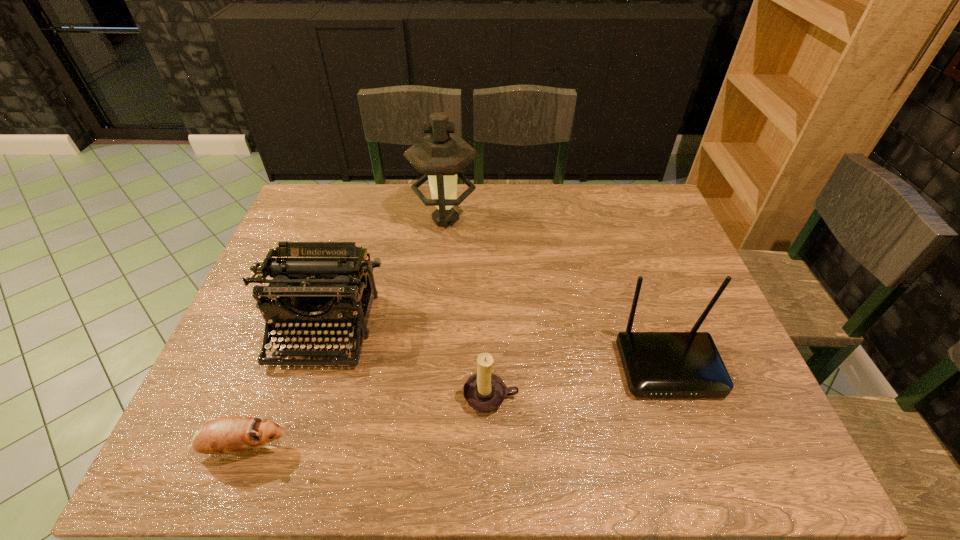
The image size is (960, 540). In order to click on free space between the typewriter and the second shortest object in this screenshot , I will do `click(407, 363)`.

Locate an element on the screen. Image resolution: width=960 pixels, height=540 pixels. free point between the tallest object and the candle holder is located at coordinates (468, 308).

Locate an element on the screen. The height and width of the screenshot is (540, 960). free space between the rightmost object and the tallest object is located at coordinates (557, 293).

In order to click on object that stands as the fourth closest to the tallest object in this screenshot , I will do `click(224, 435)`.

Identify the location of object that is the third nearest to the hamster. (439, 156).

This screenshot has height=540, width=960. I want to click on blank space that satisfies the following two spatial constraints: 1. on the typing side of the typewriter; 2. at the face of the shortest object, so click(x=285, y=448).

Identify the location of free spot that satisfies the following two spatial constraints: 1. on the wick of the fourth tallest object; 2. at the face of the hamster. pos(492,448).

This screenshot has height=540, width=960. Find the location of `free point that satisfies the following two spatial constraints: 1. on the typing side of the typewriter; 2. at the face of the hamster`. free point that satisfies the following two spatial constraints: 1. on the typing side of the typewriter; 2. at the face of the hamster is located at coordinates (285, 448).